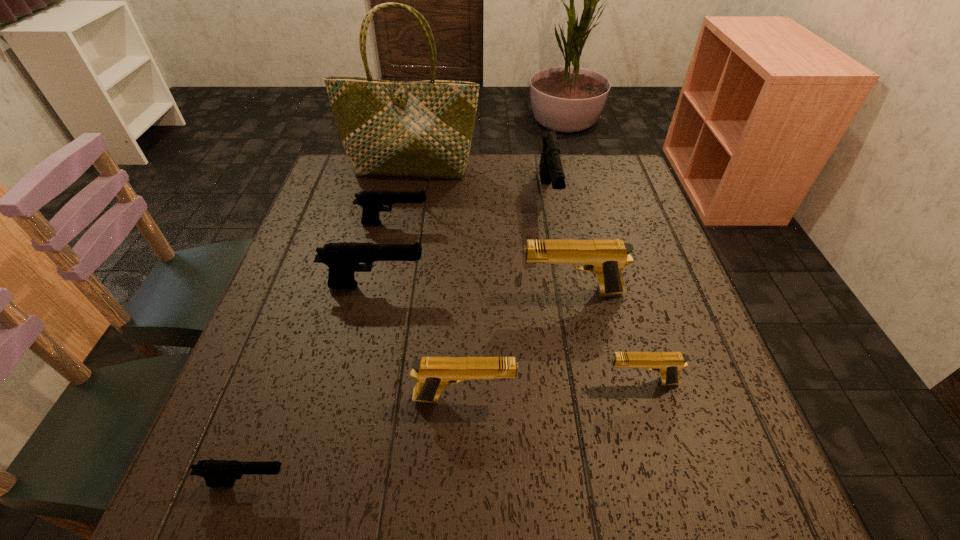
Identify the location of the nearest pistol. The height and width of the screenshot is (540, 960). (217, 473).

At what (x,y) coordinates should I click in order to perform the action: click on the nearest object. Please return your answer as a coordinate pair (x, y). The height and width of the screenshot is (540, 960). Looking at the image, I should click on (217, 473).

At what (x,y) coordinates should I click in order to perform the action: click on free spot located 0.320m on the right of the tallest object. Please return your answer as a coordinate pair (x, y). Looking at the image, I should click on (589, 171).

The width and height of the screenshot is (960, 540). I want to click on vacant space positioned 0.360m on the front-facing side of the biggest black pistol, so click(x=575, y=342).

Find the location of a particular element. vacant space situated 0.370m at the barrel of the biggest tan pistol is located at coordinates (350, 292).

Where is `vacant space located at the barrel of the biggest tan pistol`? Image resolution: width=960 pixels, height=540 pixels. vacant space located at the barrel of the biggest tan pistol is located at coordinates (479, 292).

The width and height of the screenshot is (960, 540). Identify the location of free region located 0.400m at the barrel of the biggest tan pistol. (337, 292).

Where is `free space located on the front-facing side of the second nearest black pistol`? free space located on the front-facing side of the second nearest black pistol is located at coordinates (476, 286).

Where is `free space located 0.200m at the barrel of the second nearest pistol`? The width and height of the screenshot is (960, 540). free space located 0.200m at the barrel of the second nearest pistol is located at coordinates (627, 397).

Where is `vacant space located 0.080m on the front-facing side of the second smallest black pistol`? The image size is (960, 540). vacant space located 0.080m on the front-facing side of the second smallest black pistol is located at coordinates (460, 223).